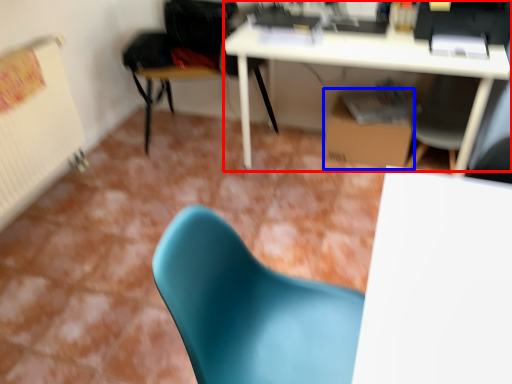
Question: Among these objects, which one is nearest to the camera, desk (highlighted by a red box) or cardboard box (highlighted by a blue box)?

Choices:
 (A) desk
 (B) cardboard box

Answer: (A)